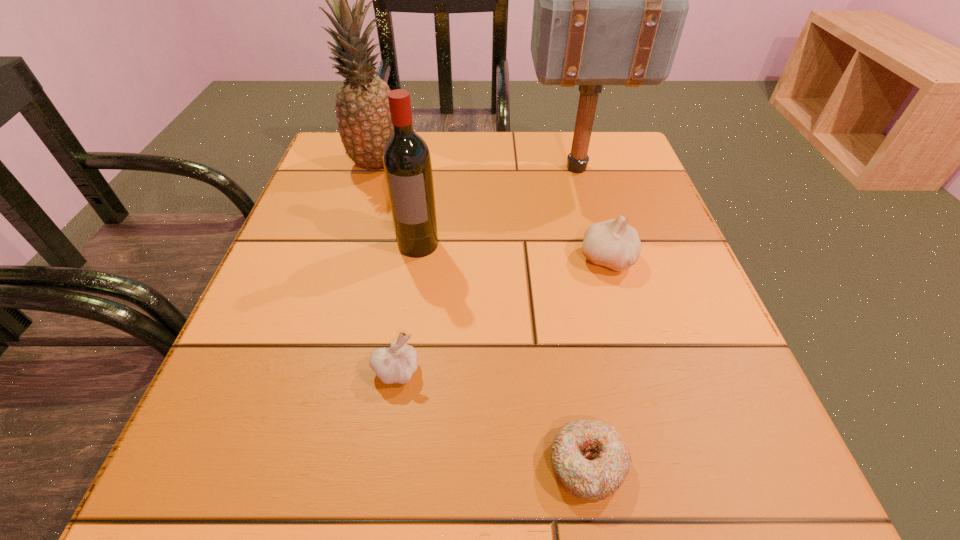
Where is `object that is positioned at the left edge`? object that is positioned at the left edge is located at coordinates (363, 115).

Where is `mallet that is at the right edge`? This screenshot has height=540, width=960. mallet that is at the right edge is located at coordinates (610, 0).

Where is `garlic located at the right edge`? The height and width of the screenshot is (540, 960). garlic located at the right edge is located at coordinates (613, 243).

The height and width of the screenshot is (540, 960). Find the location of `object that is positioned at the far left corner`. object that is positioned at the far left corner is located at coordinates (x=363, y=115).

The height and width of the screenshot is (540, 960). Identify the location of object that is at the far right corner. (610, 0).

Find the location of a particular element. The width and height of the screenshot is (960, 540). free space at the far edge of the desktop is located at coordinates (504, 151).

This screenshot has width=960, height=540. In the image, there is a desktop. What are the coordinates of `vacant space at the near edge` in the screenshot? It's located at (311, 459).

I want to click on free space at the left edge of the desktop, so pyautogui.click(x=292, y=244).

Image resolution: width=960 pixels, height=540 pixels. I want to click on vacant space at the right edge of the desktop, so click(703, 316).

Image resolution: width=960 pixels, height=540 pixels. What are the coordinates of `vacant region at the far left corner of the desktop` in the screenshot? It's located at (322, 162).